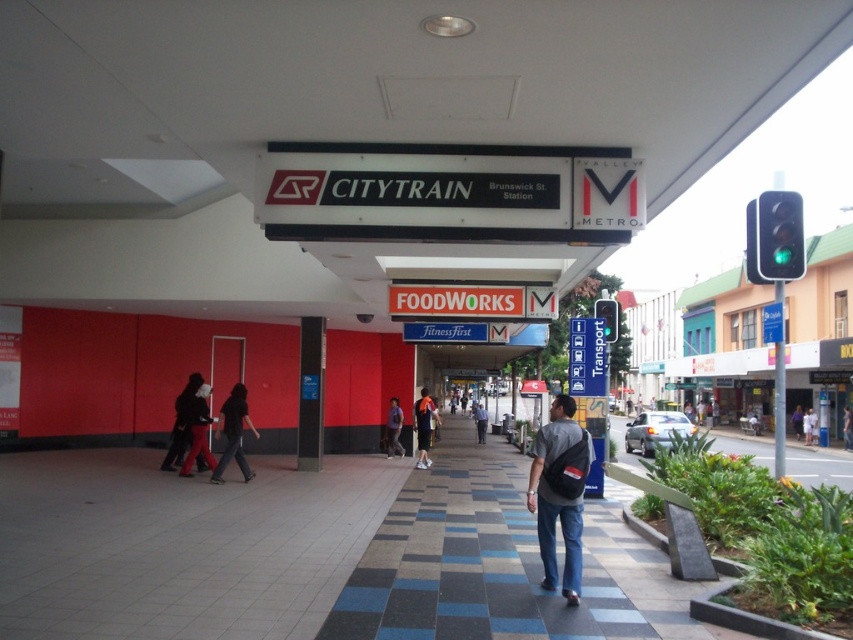
You are a commuter at the Brunswick St Station platform. You have two items with you, a matte black backpack at center and a matte black jacket at center. Which item can you store in a locker that has a maximum capacity of 0.5 cubic feet without exceeding the limit?

The matte black backpack at center is smaller than the matte black jacket at center, so the matte black backpack at center can be stored in the locker without exceeding the 0.5 cubic feet limit.

You are a traveler at the Brunswick St Station platform and you have a matte black backpack at center and a matte black jacket at center. Which item takes up more horizontal space?

The matte black jacket at center takes up more horizontal space since it has a greater width than the matte black backpack at center.

You are a delivery person who needs to place a dark gray backpack at center on the platform without blocking the green glass traffic light at center. Can you do this based on their sizes?

The green glass traffic light at center is much taller than the dark gray backpack at center, so placing the dark gray backpack at center won not block the traffic light as it is shorter.